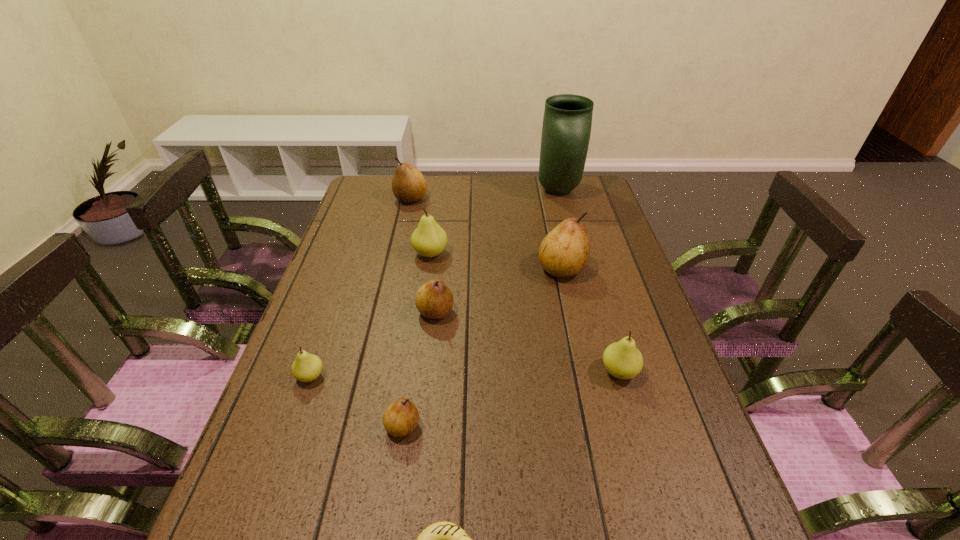
Find the location of a particular element. The height and width of the screenshot is (540, 960). vacant region at the right edge of the desktop is located at coordinates (695, 498).

Image resolution: width=960 pixels, height=540 pixels. Find the location of `vacant space at the far left corner of the desktop`. vacant space at the far left corner of the desktop is located at coordinates (367, 198).

Identify the location of vacant space that is in between the second green pear from right to left and the nearest brown pear. (417, 340).

The image size is (960, 540). I want to click on free space that is in between the biggest brown pear and the rightmost green pear, so pos(590,320).

Identify the location of vacant space that is in between the farthest green pear and the second tallest object. (496, 261).

The image size is (960, 540). I want to click on free space between the second biggest brown pear and the eighth shortest object, so point(487,234).

The height and width of the screenshot is (540, 960). Identify the location of free spot between the second biggest green pear and the eighth farthest object. (511, 399).

What are the coordinates of `unoccupied position between the third biggest brown pear and the tallest object` in the screenshot? It's located at (497, 251).

The image size is (960, 540). Identify the location of vacant point located between the third nearest brown pear and the smallest green pear. (436, 322).

Point out which object is positioned as the eighth nearest to the shortest object. Please provide its 2D coordinates. Your answer should be formatted as a tuple, i.e. [(x, y)], where the tuple contains the x and y coordinates of a point satisfying the conditions above.

[(567, 121)]